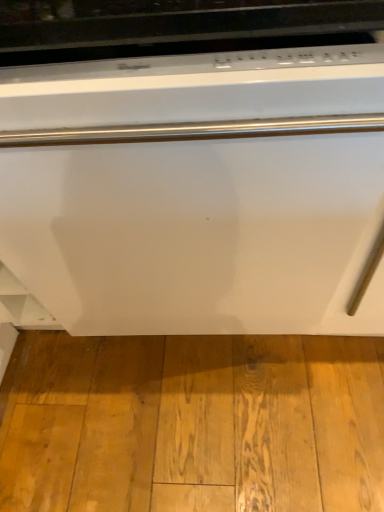
The image size is (384, 512). Describe the element at coordinates (192, 167) in the screenshot. I see `white glossy dishwasher at center` at that location.

Image resolution: width=384 pixels, height=512 pixels. In order to click on white glossy dishwasher at center in this screenshot , I will do point(192,167).

What do you see at coordinates (192, 423) in the screenshot? Image resolution: width=384 pixels, height=512 pixels. I see `light brown wood flooring at lower center` at bounding box center [192, 423].

Where is `light brown wood flooring at lower center`? light brown wood flooring at lower center is located at coordinates [x=192, y=423].

The image size is (384, 512). I want to click on white glossy dishwasher at center, so click(192, 167).

Does white glossy dishwasher at center appear on the right side of light brown wood flooring at lower center?

Incorrect, white glossy dishwasher at center is not on the right side of light brown wood flooring at lower center.

Considering the positions of objects white glossy dishwasher at center and light brown wood flooring at lower center in the image provided, who is in front, white glossy dishwasher at center or light brown wood flooring at lower center?

white glossy dishwasher at center.

Considering the positions of points (309, 172) and (223, 497), is point (309, 172) closer to camera compared to point (223, 497)?

Yes, it is in front of point (223, 497).

From the image's perspective, which is above, white glossy dishwasher at center or light brown wood flooring at lower center?

From the image's view, white glossy dishwasher at center is above.

From a real-world perspective, relative to light brown wood flooring at lower center, is white glossy dishwasher at center vertically above or below?

Clearly, from a real-world perspective, white glossy dishwasher at center is above light brown wood flooring at lower center.

Considering the sizes of objects white glossy dishwasher at center and light brown wood flooring at lower center in the image provided, who is wider, white glossy dishwasher at center or light brown wood flooring at lower center?

Wider between the two is white glossy dishwasher at center.

Who is shorter, white glossy dishwasher at center or light brown wood flooring at lower center?

light brown wood flooring at lower center is shorter.

Between white glossy dishwasher at center and light brown wood flooring at lower center, which one has larger size?

white glossy dishwasher at center.

Is light brown wood flooring at lower center completely or partially inside white glossy dishwasher at center?

No.

Are white glossy dishwasher at center and light brown wood flooring at lower center making contact?

No, white glossy dishwasher at center is not in contact with light brown wood flooring at lower center.

Is white glossy dishwasher at center oriented away from light brown wood flooring at lower center?

white glossy dishwasher at center is not turned away from light brown wood flooring at lower center.

How different are the orientations of white glossy dishwasher at center and light brown wood flooring at lower center in degrees?

There is a 177-degree angle between the facing directions of white glossy dishwasher at center and light brown wood flooring at lower center.

Identify the location of home appliance above the light brown wood flooring at lower center (from the image's perspective). This screenshot has height=512, width=384. pyautogui.click(x=192, y=167).

Which is more to the left, light brown wood flooring at lower center or white glossy dishwasher at center?

From the viewer's perspective, white glossy dishwasher at center appears more on the left side.

Considering the relative positions of light brown wood flooring at lower center and white glossy dishwasher at center in the image provided, is light brown wood flooring at lower center behind white glossy dishwasher at center?

Yes, light brown wood flooring at lower center is further from the camera.

Is point (144, 401) closer or farther from the camera than point (137, 34)?

Point (144, 401) appears to be farther away from the viewer than point (137, 34).

From the picture: From the image's perspective, between light brown wood flooring at lower center and white glossy dishwasher at center, which one is located above?

white glossy dishwasher at center, from the image's perspective.

From a real-world perspective, who is located higher, light brown wood flooring at lower center or white glossy dishwasher at center?

white glossy dishwasher at center.

Can you confirm if light brown wood flooring at lower center is thinner than white glossy dishwasher at center?

Indeed, light brown wood flooring at lower center has a lesser width compared to white glossy dishwasher at center.

Considering the sizes of objects light brown wood flooring at lower center and white glossy dishwasher at center in the image provided, who is shorter, light brown wood flooring at lower center or white glossy dishwasher at center?

light brown wood flooring at lower center.

Which of these two, light brown wood flooring at lower center or white glossy dishwasher at center, is smaller?

light brown wood flooring at lower center is smaller.

Is white glossy dishwasher at center a part of light brown wood flooring at lower center?

Actually, white glossy dishwasher at center is outside light brown wood flooring at lower center.

Is there a large distance between light brown wood flooring at lower center and white glossy dishwasher at center?

They are positioned close to each other.

Is light brown wood flooring at lower center aimed at white glossy dishwasher at center?

No, light brown wood flooring at lower center is not aimed at white glossy dishwasher at center.

Measure the distance from light brown wood flooring at lower center to white glossy dishwasher at center.

light brown wood flooring at lower center and white glossy dishwasher at center are 18.47 inches apart.

Locate an element on the screen. This screenshot has width=384, height=512. hardwood below the white glossy dishwasher at center (from the image's perspective) is located at coordinates (192, 423).

Where is `hardwood to the right of white glossy dishwasher at center`? This screenshot has height=512, width=384. hardwood to the right of white glossy dishwasher at center is located at coordinates (192, 423).

This screenshot has height=512, width=384. Find the location of `home appliance on the left side of light brown wood flooring at lower center`. home appliance on the left side of light brown wood flooring at lower center is located at coordinates (192, 167).